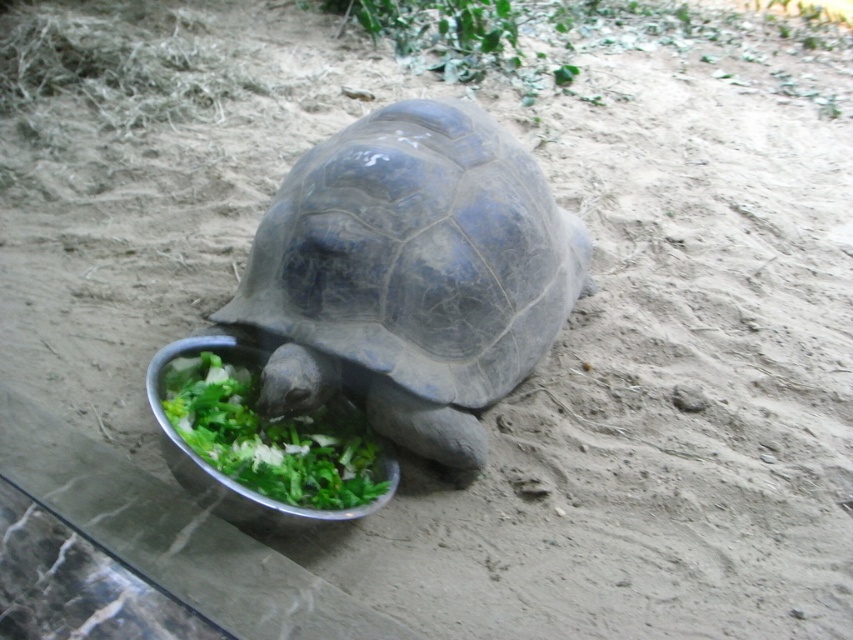
You are a photographer trying to capture the smooth gray tortoise at center and the metallic silver bowl at lower center in the same frame. Based on their positions, which object is closer to the camera?

The smooth gray tortoise at center is above the metallic silver bowl at lower center, so it is closer to the camera.

You are a small toy that is 10 cm in height. You want to hide behind the smooth gray tortoise at center so that you are not seen by someone looking from the front. Will the metallic silver bowl at lower center block your view?

The smooth gray tortoise at center is bigger than the metallic silver bowl at lower center. Since the tortoise is larger, it would likely block the view of the toy more effectively than the bowl. Therefore, hiding behind the smooth gray tortoise at center would be better to avoid being seen from the front.